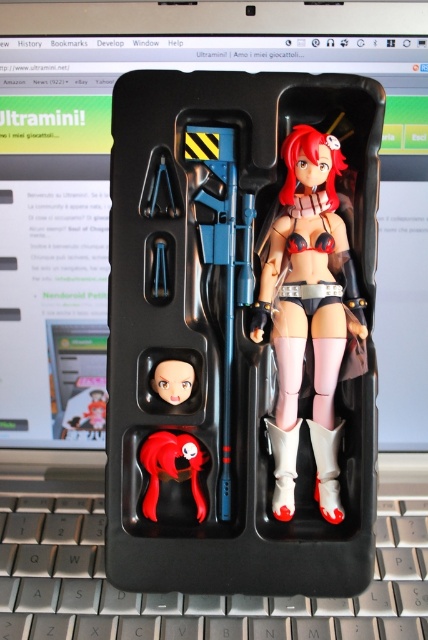
Question: Which of the following is the closest to the observer?

Choices:
 (A) (294, 408)
 (B) (152, 470)

Answer: (B)

Question: Which of the following is the closest to the observer?

Choices:
 (A) (175, 362)
 (B) (92, 417)

Answer: (A)

Question: From the image, what is the correct spatial relationship of satin black bikini at center in relation to matte black head at lower left?

Choices:
 (A) below
 (B) above

Answer: (B)

Question: Which point is farther to the camera?

Choices:
 (A) (282, 324)
 (B) (145, 618)
 (C) (148, 516)
 (D) (169, 397)

Answer: (B)

Question: From the image, what is the correct spatial relationship of satin black bikini at center in relation to matte plastic head at lower left?

Choices:
 (A) left
 (B) right

Answer: (B)

Question: Is satin black bikini at center wider than matte black head at lower left?

Choices:
 (A) no
 (B) yes

Answer: (B)